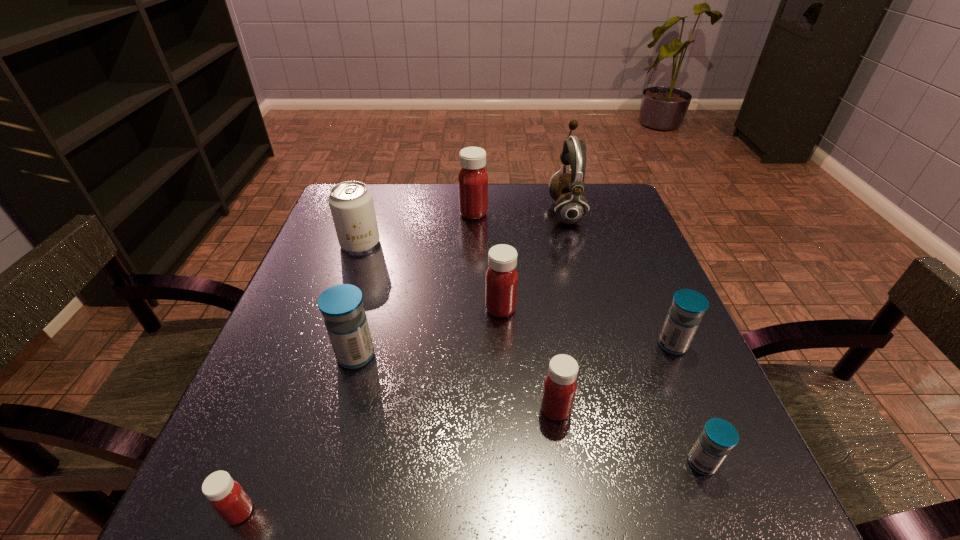
Identify the location of free space that satisfies the following two spatial constraints: 1. on the back side of the second smallest blue medicine; 2. on the right side of the smallest blue medicine. The image size is (960, 540). (656, 345).

At what (x,y) coordinates should I click in order to perform the action: click on free space that satisfies the following two spatial constraints: 1. on the front side of the sixth object from left to right; 2. on the right side of the eighth farthest object. Please return your answer as a coordinate pair (x, y). This screenshot has height=540, width=960. Looking at the image, I should click on [x=564, y=463].

The width and height of the screenshot is (960, 540). I want to click on free space that satisfies the following two spatial constraints: 1. on the ear pads of the second biggest blue medicine; 2. on the right side of the tallest object, so click(x=602, y=345).

Where is `vacant region that satisfies the following two spatial constraints: 1. on the front side of the biggest red medicine; 2. on the left side of the second farthest red medicine`? vacant region that satisfies the following two spatial constraints: 1. on the front side of the biggest red medicine; 2. on the left side of the second farthest red medicine is located at coordinates (471, 309).